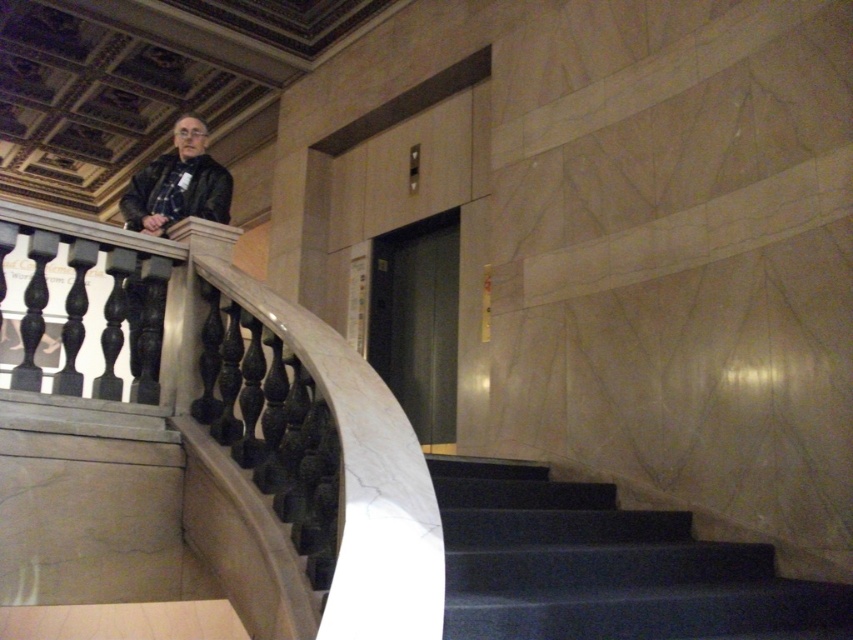
Between matte black jacket at upper left and matte black jacket at left, which one appears on the right side from the viewer's perspective?

matte black jacket at left is more to the right.

Find the location of a particular element. The width and height of the screenshot is (853, 640). matte black jacket at upper left is located at coordinates (178, 184).

Can you confirm if dark gray carpeted stairs at lower center is thinner than matte black jacket at left?

No.

Is point (608, 625) closer to viewer compared to point (207, 189)?

That is True.

The image size is (853, 640). I want to click on dark gray carpeted stairs at lower center, so click(x=605, y=566).

Can you confirm if white marble railing at upper left is wider than dark gray carpeted stairs at lower center?

Indeed, white marble railing at upper left has a greater width compared to dark gray carpeted stairs at lower center.

Does point (260, 403) lie in front of point (467, 573)?

No.

Identify the location of white marble railing at upper left. (207, 454).